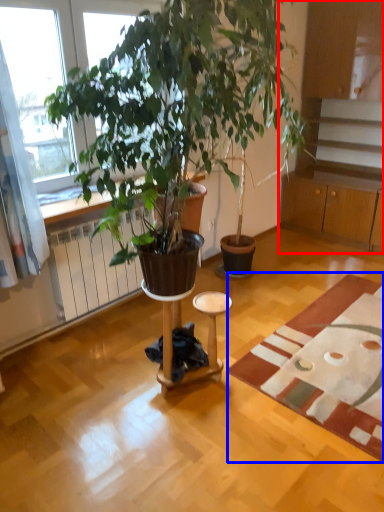
Question: Which point is further to the camera, cabinetry (highlighted by a red box) or mat (highlighted by a blue box)?

Choices:
 (A) cabinetry
 (B) mat

Answer: (A)